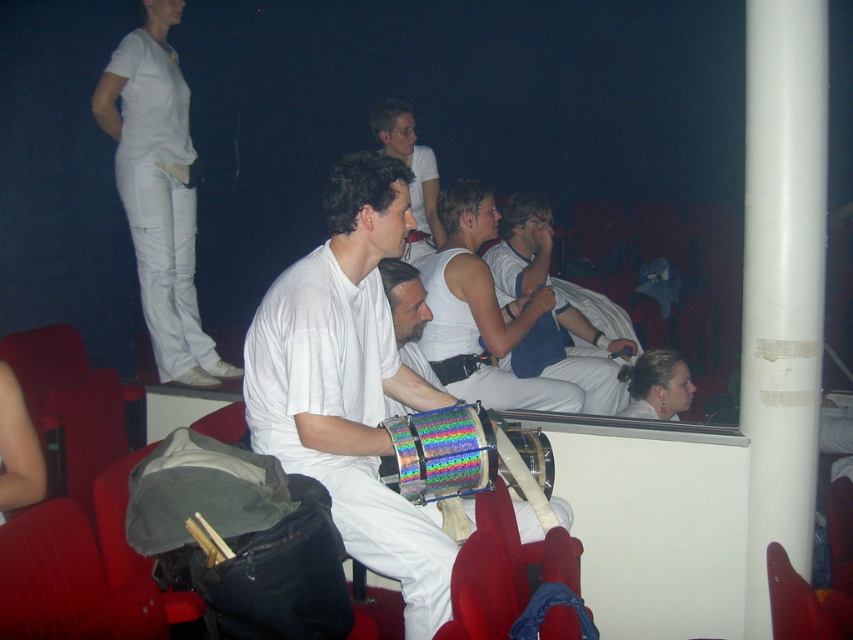
Question: Is white fabric tank top at center positioned behind white fabric at center?

Choices:
 (A) yes
 (B) no

Answer: (B)

Question: Does white matte shirt at center appear on the right side of white fabric at center?

Choices:
 (A) no
 (B) yes

Answer: (A)

Question: Which point is closer to the camera?

Choices:
 (A) (596, 369)
 (B) (151, 195)

Answer: (B)

Question: Does white cotton shirt at upper left lie behind white matte tank top at center?

Choices:
 (A) yes
 (B) no

Answer: (B)

Question: Which point is farther to the camera?

Choices:
 (A) (302, 371)
 (B) (445, 252)

Answer: (B)

Question: Which object is the closest to the white matte shirt at center?

Choices:
 (A) white fabric at center
 (B) white fabric tank top at center

Answer: (B)